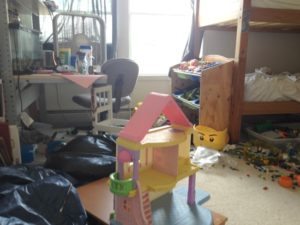
Locate an element on the screen. The image size is (300, 225). toy box is located at coordinates (226, 86), (168, 76).